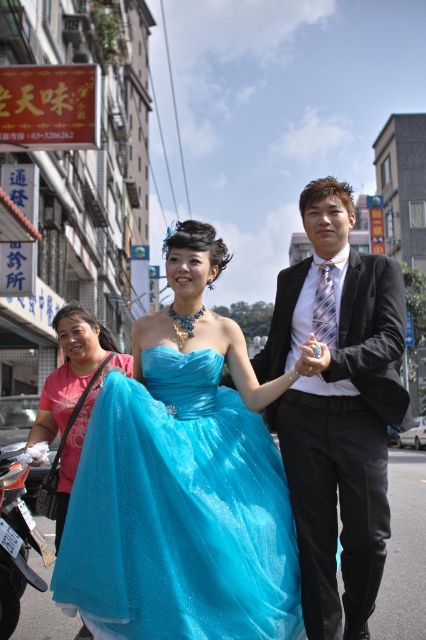
Based on the photo, you are a photographer trying to capture a perfect shot of the turquoise satin dress at center. Based on the coordinates provided, where should you position your camera to ensure the dress is the main focus?

The turquoise satin dress at center is located at coordinates point (336, 406), so positioning the camera to focus on that point will ensure the dress is the main subject of the photo.

You are a photographer setting up for a group photo. You need to ensure that the turquoise satin dress at center and the shiny blue dress at center are both fully visible in the frame. Based on their widths, which dress might require more space to accommodate its width?

The turquoise satin dress at center might be wider than the shiny blue dress at center, so it might require more space to accommodate its width.